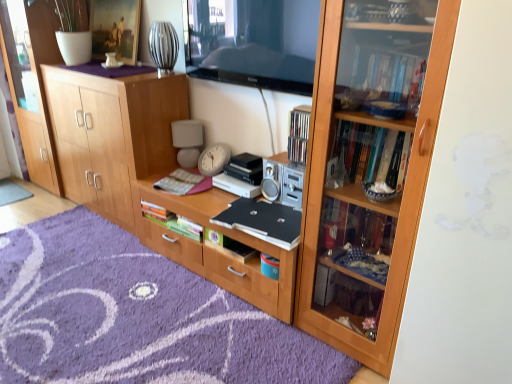
Question: From a real-world perspective, is transparent wood cabinet at left physically located above or below gray fabric doormat at lower left, which appears as the first doormat when viewed from the back?

Choices:
 (A) above
 (B) below

Answer: (A)

Question: Considering the positions of transparent wood cabinet at left and gray fabric doormat at lower left, arranged as the 2th doormat when ordered from the bottom, in the image, is transparent wood cabinet at left taller or shorter than gray fabric doormat at lower left, arranged as the 2th doormat when ordered from the bottom,?

Choices:
 (A) short
 (B) tall

Answer: (B)

Question: Considering the real-world distances, which object is farthest from the wooden desk at center?

Choices:
 (A) black matte laptop at center
 (B) hardcover book at center, placed as the 1th book when sorted from top to bottom
 (C) transparent wood cabinet at left
 (D) hardcover book at center, which appears as the 3th book when viewed from the top
 (E) hardcover book at center, which ranks as the second book in top-to-bottom order

Answer: (C)

Question: Which is farther from the matte white lampshade at center?

Choices:
 (A) wooden bookcase at right
 (B) matte wooden picture frame at upper center
 (C) black matte laptop at center
 (D) transparent wood cabinet at left
 (E) hardcover book at center, which appears as the 3th book when viewed from the top

Answer: (A)